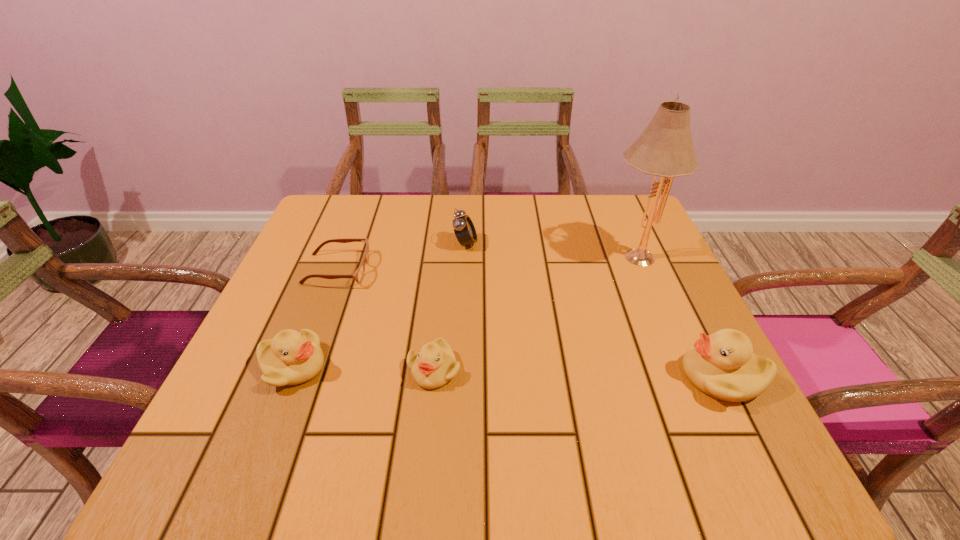
You are a GUI agent. You are given a task and a screenshot of the screen. Output one action in this format:
    pyautogui.click(x=<x>, y=<y>)
    Task: Click on the free space between the tallest object and the shortest object
    The image size is (960, 540).
    Given the screenshot: What is the action you would take?
    pyautogui.click(x=486, y=262)

At what (x,y) coordinates should I click in order to perform the action: click on vacant area that lies between the tallest object and the rightmost duckling. Please return your answer as a coordinate pair (x, y). The height and width of the screenshot is (540, 960). Looking at the image, I should click on (678, 315).

At what (x,y) coordinates should I click in order to perform the action: click on free point between the spectacles and the second tallest duckling. Please return your answer as a coordinate pair (x, y). Looking at the image, I should click on (315, 318).

You are a GUI agent. You are given a task and a screenshot of the screen. Output one action in this format:
    pyautogui.click(x=<x>, y=<y>)
    Task: Click on the free point between the tallest duckling and the alarm clock
    
    Given the screenshot: What is the action you would take?
    pyautogui.click(x=593, y=310)

This screenshot has width=960, height=540. I want to click on empty location between the spectacles and the lampshade, so click(x=486, y=262).

I want to click on free spot between the shortest duckling and the alarm clock, so click(450, 307).

The image size is (960, 540). I want to click on unoccupied position between the rightmost duckling and the alarm clock, so click(x=593, y=310).

The image size is (960, 540). What are the coordinates of `free point between the tallest duckling and the second duckling from left to right` in the screenshot? It's located at (578, 373).

The width and height of the screenshot is (960, 540). Find the location of `free space that is in between the lampshade and the spectacles`. free space that is in between the lampshade and the spectacles is located at coordinates (486, 262).

The height and width of the screenshot is (540, 960). I want to click on empty space between the lampshade and the rightmost duckling, so click(x=678, y=315).